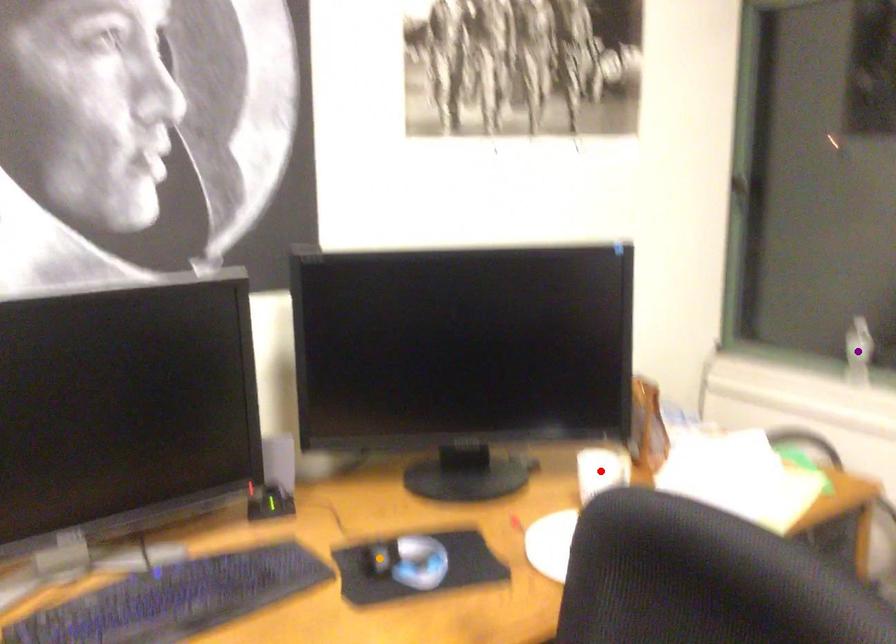
Order these from nearest to farthest:
1. orange point
2. red point
3. purple point

1. orange point
2. red point
3. purple point